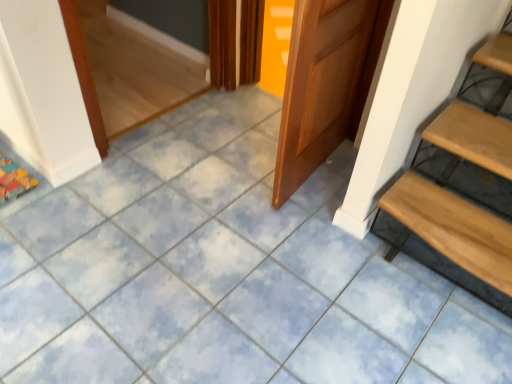
Question: From a real-world perspective, is light brown wooden stairs at lower right physically below wooden door at center?

Choices:
 (A) yes
 (B) no

Answer: (A)

Question: Could you tell me if light brown wooden stairs at lower right is turned towards wooden door at center?

Choices:
 (A) no
 (B) yes

Answer: (A)

Question: Can you confirm if light brown wooden stairs at lower right is smaller than wooden door at center?

Choices:
 (A) no
 (B) yes

Answer: (A)

Question: Can you confirm if light brown wooden stairs at lower right is thinner than wooden door at center?

Choices:
 (A) yes
 (B) no

Answer: (B)

Question: Is wooden door at center inside light brown wooden stairs at lower right?

Choices:
 (A) yes
 (B) no

Answer: (B)

Question: Is light brown wooden stairs at lower right with wooden door at center?

Choices:
 (A) no
 (B) yes

Answer: (A)

Question: Can you confirm if wooden door at center is shorter than light brown wooden stairs at lower right?

Choices:
 (A) yes
 (B) no

Answer: (B)

Question: From a real-world perspective, is wooden door at center over light brown wooden stairs at lower right?

Choices:
 (A) yes
 (B) no

Answer: (A)

Question: Is wooden door at center positioned before light brown wooden stairs at lower right?

Choices:
 (A) no
 (B) yes

Answer: (B)

Question: Is wooden door at center not close to light brown wooden stairs at lower right?

Choices:
 (A) no
 (B) yes

Answer: (A)

Question: From the image's perspective, is wooden door at center below light brown wooden stairs at lower right?

Choices:
 (A) no
 (B) yes

Answer: (A)

Question: From a real-world perspective, is wooden door at center below light brown wooden stairs at lower right?

Choices:
 (A) yes
 (B) no

Answer: (B)

Question: Relative to light brown wooden stairs at lower right, is wooden door at center in front or behind?

Choices:
 (A) behind
 (B) front

Answer: (B)